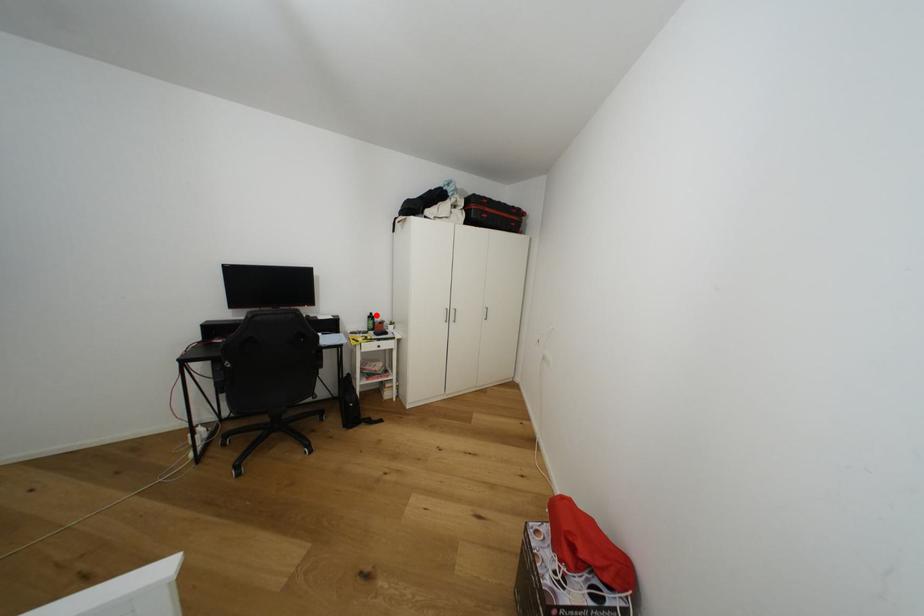
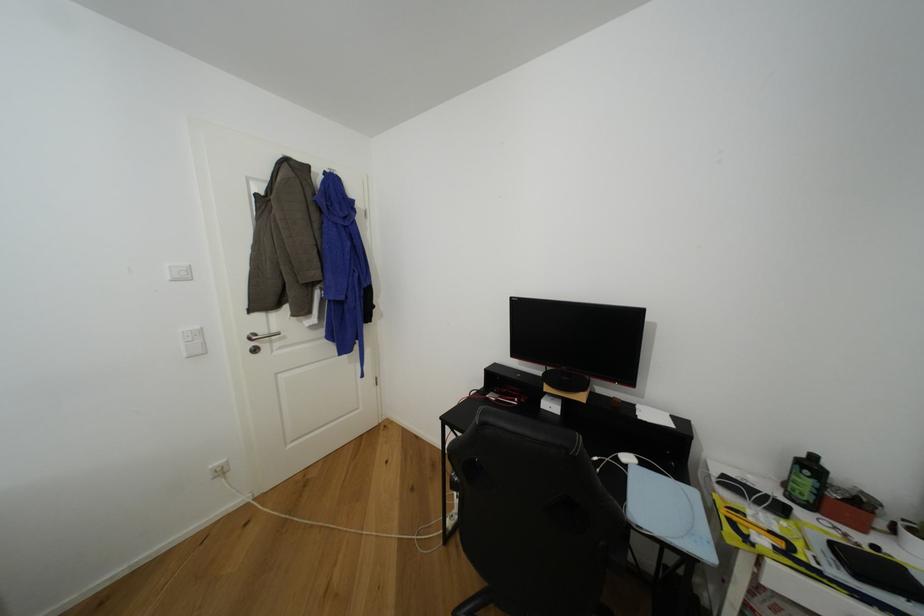
Locate, in the second image, the point that corresponds to the highlighted location in the first image.

(820, 459)